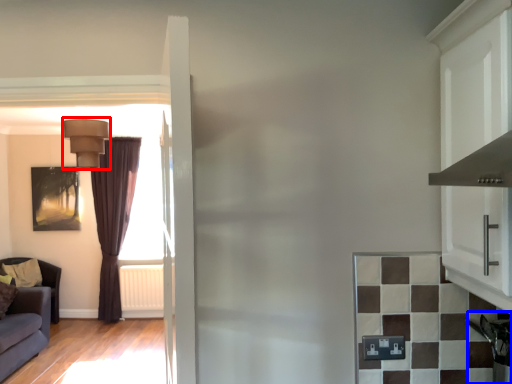
Question: Among these objects, which one is farthest to the camera, light fixture (highlighted by a red box) or appliance (highlighted by a blue box)?

Choices:
 (A) light fixture
 (B) appliance

Answer: (A)